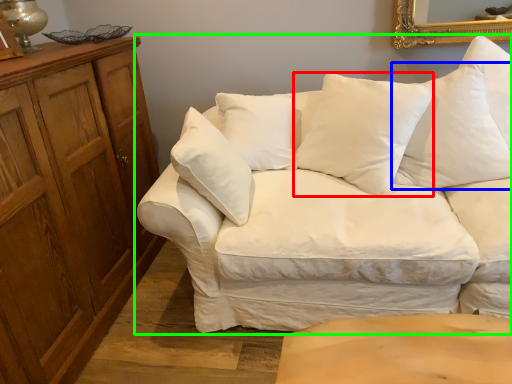
Question: Which object is positioned closest to pillow (highlighted by a red box)? Select from pillow (highlighted by a blue box) and studio couch (highlighted by a green box).

Choices:
 (A) pillow
 (B) studio couch

Answer: (B)